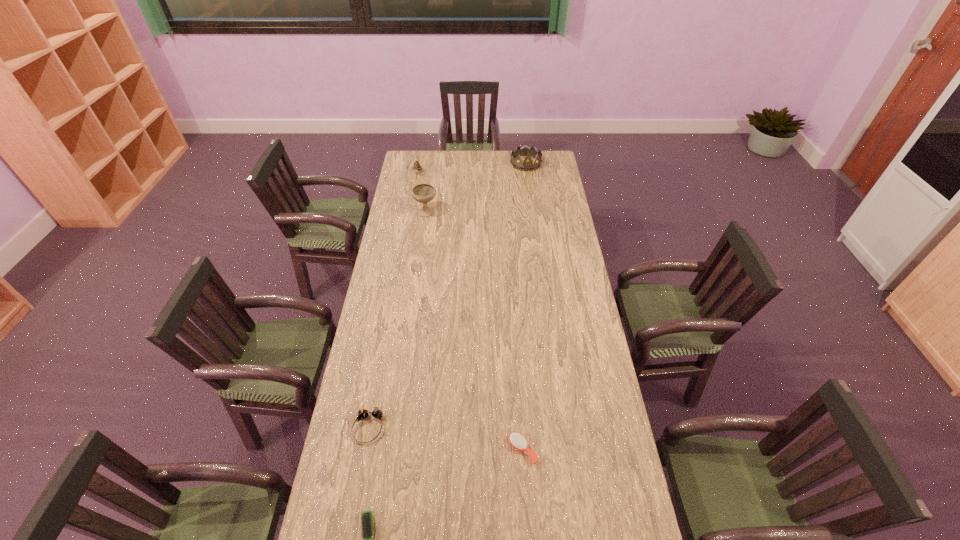
Locate an element on the screen. This screenshot has width=960, height=540. free region at the right edge of the desktop is located at coordinates (590, 477).

Identify the location of free space between the snail and the tiara. (471, 168).

Identify the location of free space between the tiara and the goggles. The width and height of the screenshot is (960, 540). (447, 295).

In order to click on object that is the fifth closest to the fourth shortest object in this screenshot , I will do `click(366, 516)`.

Select which object appears as the closest to the fourth nearest object. Please provide its 2D coordinates. Your answer should be formatted as a tuple, i.e. [(x, y)], where the tuple contains the x and y coordinates of a point satisfying the conditions above.

[(417, 167)]

Where is `blank space that satisfies the following two spatial constraints: 1. through the lenses of the farther hairbrush; 2. on the left side of the third shortest object`? blank space that satisfies the following two spatial constraints: 1. through the lenses of the farther hairbrush; 2. on the left side of the third shortest object is located at coordinates (364, 450).

You are a GUI agent. You are given a task and a screenshot of the screen. Output one action in this format:
    pyautogui.click(x=<x>, y=<y>)
    Task: Click on the vacant region that satisfies the following two spatial constraints: 1. through the lenses of the fourth tallest object; 2. on the right side of the right hairbrush
    Image resolution: width=960 pixels, height=540 pixels.
    Given the screenshot: What is the action you would take?
    pyautogui.click(x=364, y=450)

Where is `blank area in the image that satisfies the following two spatial constraints: 1. through the lenses of the farther hairbrush; 2. on the right side of the goggles`? The image size is (960, 540). blank area in the image that satisfies the following two spatial constraints: 1. through the lenses of the farther hairbrush; 2. on the right side of the goggles is located at coordinates tap(364, 450).